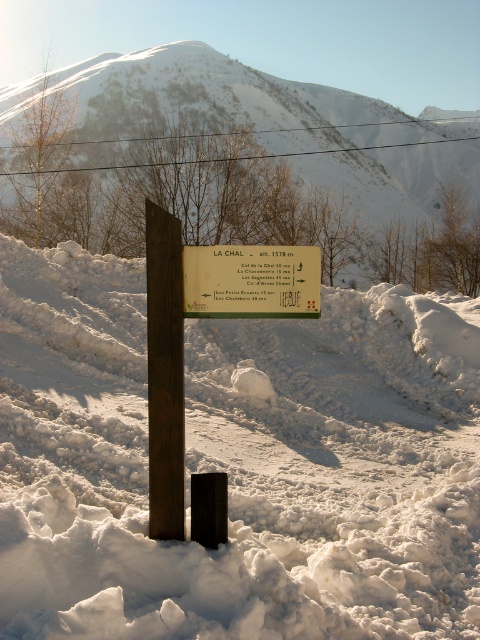
I want to click on white snow-covered mountain at upper center, so click(241, 166).

Does white snow-covered mountain at upper center have a smaller size compared to rusty wood post at center?

Actually, white snow-covered mountain at upper center might be larger than rusty wood post at center.

Find the location of a particular element. white snow-covered mountain at upper center is located at coordinates (241, 166).

You are a GUI agent. You are given a task and a screenshot of the screen. Output one action in this format:
    pyautogui.click(x=<x>, y=<y>)
    Task: Click on the white snow-covered mountain at upper center
    
    Given the screenshot: What is the action you would take?
    pyautogui.click(x=241, y=166)

Does white snow at center have a greater width compared to rusty wood post at center?

Yes, white snow at center is wider than rusty wood post at center.

Does white snow at center appear over rusty wood post at center?

Actually, white snow at center is below rusty wood post at center.

Who is more distant from viewer, (301, 513) or (168, 460)?

The point (301, 513) is behind.

At what (x,y) coordinates should I click in order to perform the action: click on white snow at center. Please return your answer as a coordinate pair (x, y). Looking at the image, I should click on (237, 464).

Between white snow at center and white plastic sign at center, which one appears on the left side from the viewer's perspective?

From the viewer's perspective, white plastic sign at center appears more on the left side.

Who is higher up, white snow at center or white plastic sign at center?

Positioned higher is white plastic sign at center.

Locate an element on the screen. The height and width of the screenshot is (640, 480). white snow at center is located at coordinates (237, 464).